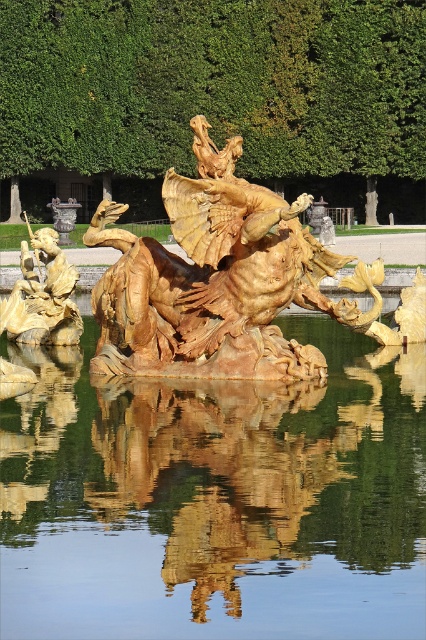
Question: Does green leafy hedge at upper center have a smaller size compared to gold reflective water at center?

Choices:
 (A) yes
 (B) no

Answer: (B)

Question: Which of these objects is positioned closest to the transparent water at center?

Choices:
 (A) green leafy hedge at upper center
 (B) gold polished statue at left

Answer: (B)

Question: Which of these objects is positioned farthest from the gold polished statue at left?

Choices:
 (A) green leafy hedge at upper center
 (B) gold polished stone dragon at center
 (C) gold reflective water at center

Answer: (A)

Question: Which point is farther to the camera?

Choices:
 (A) gold polished stone dragon at center
 (B) gold polished statue at left

Answer: (B)

Question: Does green leafy hedge at upper center appear over gold polished statue at left?

Choices:
 (A) yes
 (B) no

Answer: (A)

Question: Is gold reflective water at center positioned in front of gold polished statue at left?

Choices:
 (A) no
 (B) yes

Answer: (B)